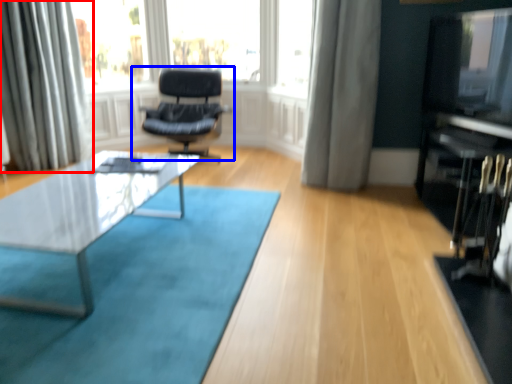
Question: Which point is closer to the camera, curtain (highlighted by a red box) or chair (highlighted by a blue box)?

Choices:
 (A) curtain
 (B) chair

Answer: (A)